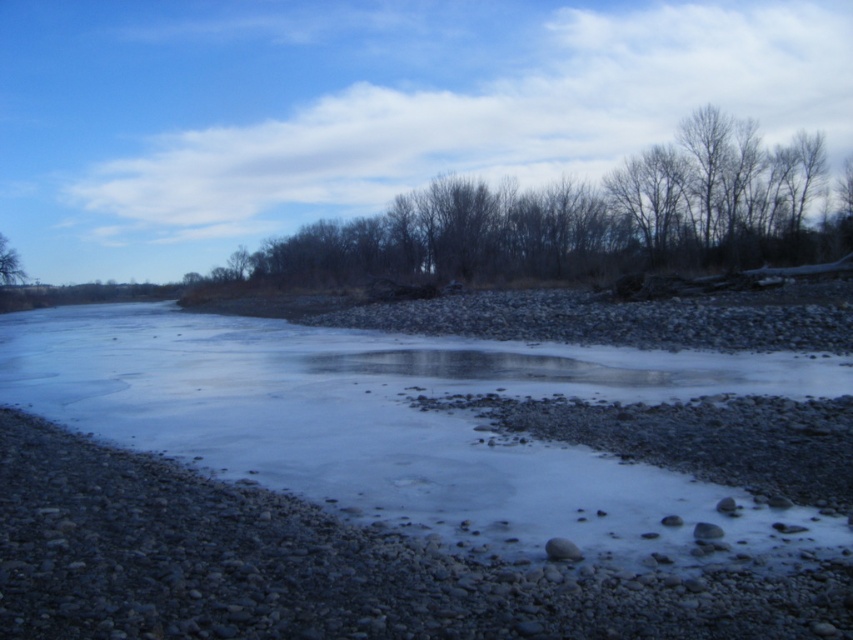
Question: Can you confirm if bare branches at upper center is bigger than brown rough tree at left?

Choices:
 (A) yes
 (B) no

Answer: (A)

Question: Which point is farther from the camera taking this photo?

Choices:
 (A) 697,534
 (B) 13,266
 (C) 373,496

Answer: (B)

Question: Is brown rough tree at left to the left of smooth gray rock at center from the viewer's perspective?

Choices:
 (A) no
 (B) yes

Answer: (B)

Question: Estimate the real-world distances between objects in this image. Which object is closer to the frozen ice at center?

Choices:
 (A) bare branches at upper center
 (B) smooth gray rock at center
 (C) smooth gray rock at lower right
 (D) brown rough tree at left

Answer: (B)

Question: Observing the image, what is the correct spatial positioning of smooth gray rock at center in reference to smooth gray rock at lower right?

Choices:
 (A) left
 (B) right

Answer: (A)

Question: Considering the real-world distances, which object is farthest from the smooth gray rock at center?

Choices:
 (A) brown rough tree at left
 (B) smooth gray rock at lower right
 (C) bare branches at upper center
 (D) frozen ice at center

Answer: (A)